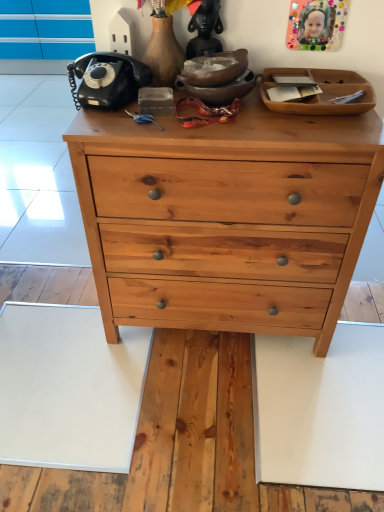
Question: From a real-world perspective, is natural wood chest of drawers at center positioned above or below matte black statue at upper center?

Choices:
 (A) below
 (B) above

Answer: (A)

Question: In the image, is natural wood chest of drawers at center positioned in front of or behind matte black statue at upper center?

Choices:
 (A) behind
 (B) front

Answer: (B)

Question: Does point (185, 304) appear closer or farther from the camera than point (213, 23)?

Choices:
 (A) farther
 (B) closer

Answer: (A)

Question: Is matte black statue at upper center in front of or behind natural wood chest of drawers at center in the image?

Choices:
 (A) behind
 (B) front

Answer: (A)

Question: Is matte black statue at upper center inside the boundaries of natural wood chest of drawers at center, or outside?

Choices:
 (A) outside
 (B) inside

Answer: (A)

Question: Is point (198, 51) closer or farther from the camera than point (254, 99)?

Choices:
 (A) farther
 (B) closer

Answer: (A)

Question: Is matte black statue at upper center wider or thinner than natural wood chest of drawers at center?

Choices:
 (A) thin
 (B) wide

Answer: (A)